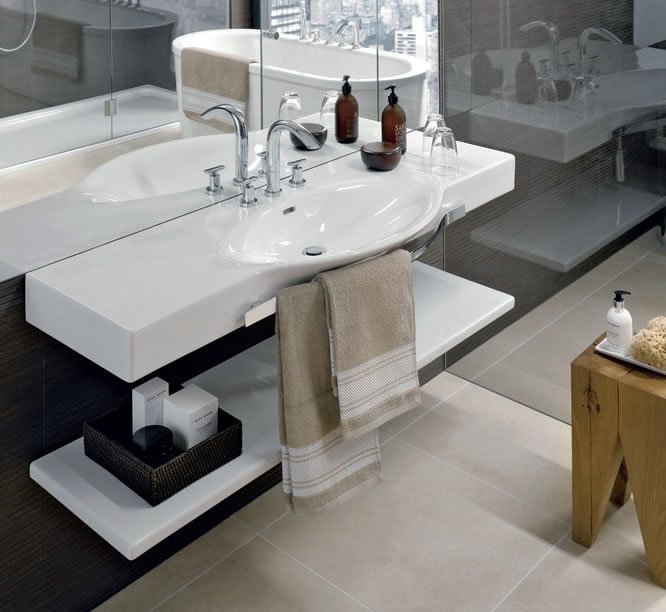
Where is `sponge`? This screenshot has width=666, height=612. sponge is located at coordinates (649, 346).